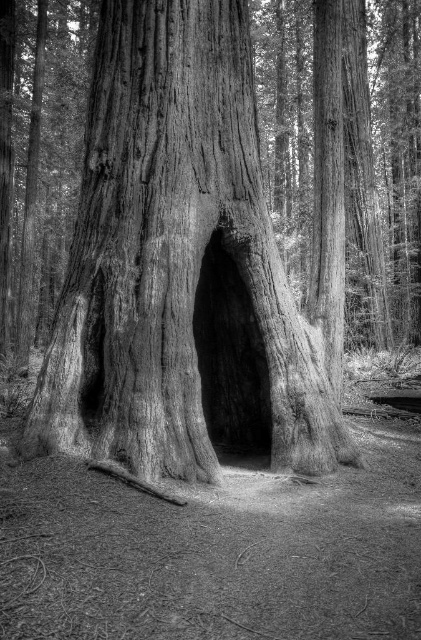
You are a small animal trying to enter the smooth wood hole at center. The grainy wood tree trunk at center is in your way. Can you pass through the space between them?

The distance between the grainy wood tree trunk at center and the smooth wood hole at center is 18.42 inches, so yes, the small animal can pass through the space between them since it is wide enough.

From the picture: You are standing in the forest looking at the ancient tree with its hollow trunk. There are two points marked in the image. The first point is at coordinates point (202,257) and the second is at point (207,380). Which point is closer to you?

Point (202,257) is in front of point (207,380), so it is closer to you.